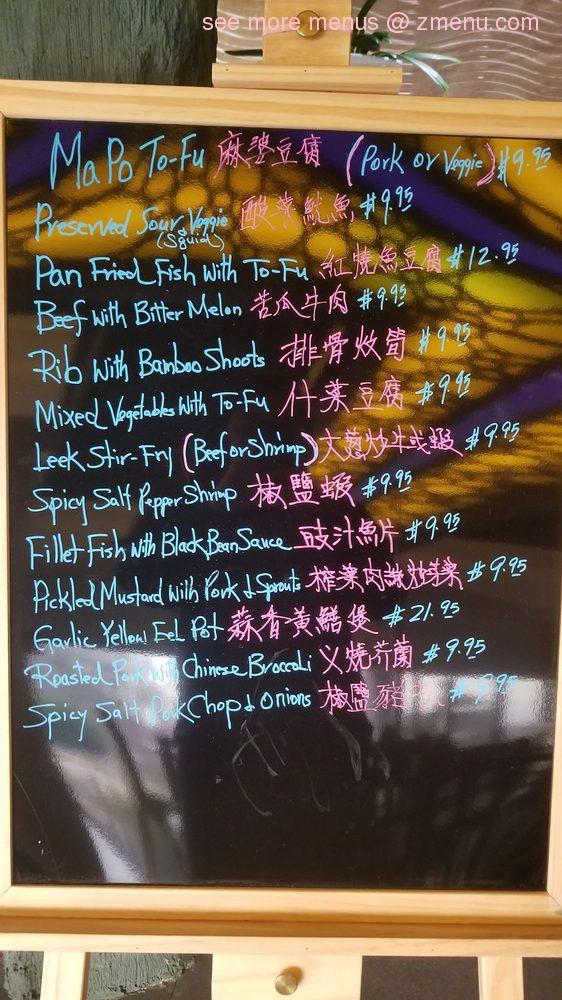
Locate an element on the screen. lights reflection in menu board is located at coordinates (107, 205).